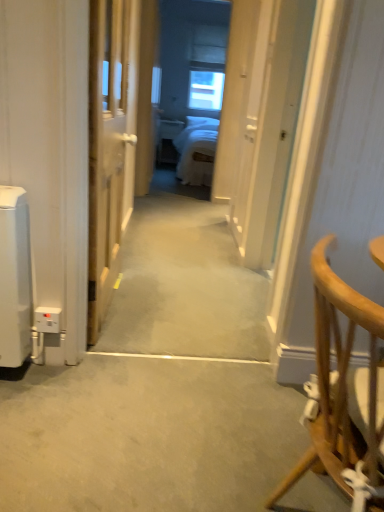
Question: Does light brown wooden chair at right have a smaller size compared to carpeted hallway at center, placed as the first path when sorted from back to front?

Choices:
 (A) no
 (B) yes

Answer: (B)

Question: Can you confirm if light brown wooden chair at right is wider than carpeted hallway at center, placed as the first path when sorted from back to front?

Choices:
 (A) yes
 (B) no

Answer: (B)

Question: From the image's perspective, is light brown wooden chair at right located above carpeted hallway at center, the second path viewed from the front?

Choices:
 (A) yes
 (B) no

Answer: (B)

Question: Considering the relative sizes of light brown wooden chair at right and carpeted hallway at center, the second path viewed from the front, in the image provided, is light brown wooden chair at right bigger than carpeted hallway at center, the second path viewed from the front,?

Choices:
 (A) yes
 (B) no

Answer: (B)

Question: Is light brown wooden chair at right at the right side of carpeted hallway at center, the second path viewed from the front?

Choices:
 (A) no
 (B) yes

Answer: (B)

Question: Is light brown wooden chair at right in front of carpeted hallway at center, the 1th path when ordered from top to bottom?

Choices:
 (A) no
 (B) yes

Answer: (B)

Question: Would you say light brown wooden chair at right is part of carpeted hallway at center, the 1th path when ordered from top to bottom,'s contents?

Choices:
 (A) yes
 (B) no

Answer: (B)

Question: Does carpeted hallway at center, the 2th path positioned from the bottom, have a greater height compared to light brown wooden chair at right?

Choices:
 (A) no
 (B) yes

Answer: (A)

Question: Can you confirm if carpeted hallway at center, the 2th path positioned from the bottom, is positioned to the right of light brown wooden chair at right?

Choices:
 (A) yes
 (B) no

Answer: (B)

Question: Is carpeted hallway at center, the second path viewed from the front, to the left of light brown wooden chair at right from the viewer's perspective?

Choices:
 (A) no
 (B) yes

Answer: (B)

Question: From a real-world perspective, is carpeted hallway at center, the 1th path when ordered from top to bottom, physically below light brown wooden chair at right?

Choices:
 (A) no
 (B) yes

Answer: (B)

Question: Is carpeted hallway at center, placed as the first path when sorted from back to front, wider than light brown wooden chair at right?

Choices:
 (A) yes
 (B) no

Answer: (A)

Question: Considering the relative sizes of gray carpet at center, acting as the first path starting from the bottom, and transparent glass window at center in the image provided, is gray carpet at center, acting as the first path starting from the bottom, wider than transparent glass window at center?

Choices:
 (A) yes
 (B) no

Answer: (A)